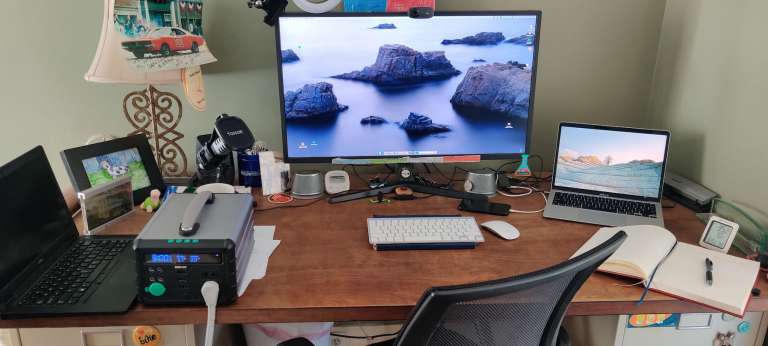
Locate an element on the screen. The image size is (768, 346). office chair is located at coordinates (507, 319).